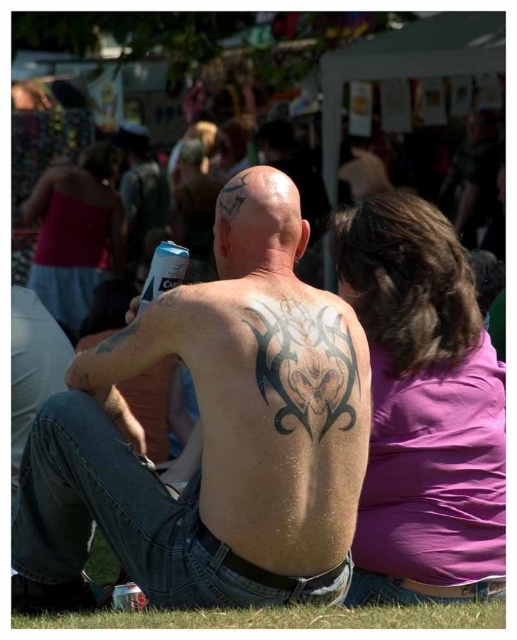
You are a photographer at the festival and want to capture the matte pink tank top at upper left in your shot. Which direction should you move your camera to focus on it?

Move your camera to the upper left direction to focus on the matte pink tank top at upper left since it is located at point [75,232].

You are a photographer at the festival and want to capture a photo that includes both the dark skin tattoo at center and the purple matte shirt at upper right. Which object should you focus on first to ensure both are in frame?

You should focus on the dark skin tattoo at center first because it is to the left of the purple matte shirt at upper right, so positioning the camera to include both would require starting from the left side where the tattoo is located.